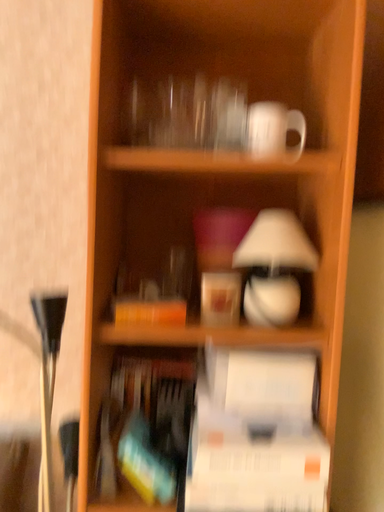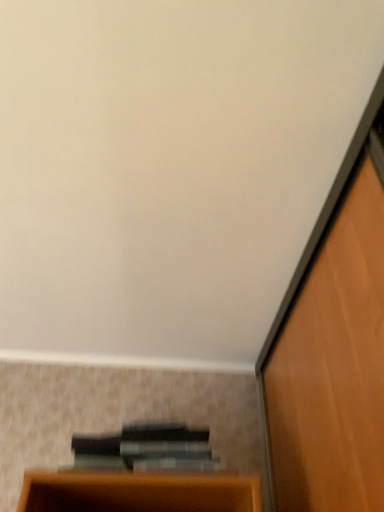
Question: How did the camera likely rotate when shooting the video?

Choices:
 (A) rotated upward
 (B) rotated downward

Answer: (A)